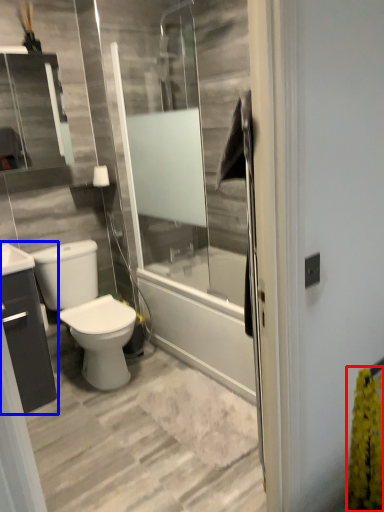
Question: Which object appears closest to the camera in this image, flower (highlighted by a red box) or bathroom cabinet (highlighted by a blue box)?

Choices:
 (A) flower
 (B) bathroom cabinet

Answer: (A)